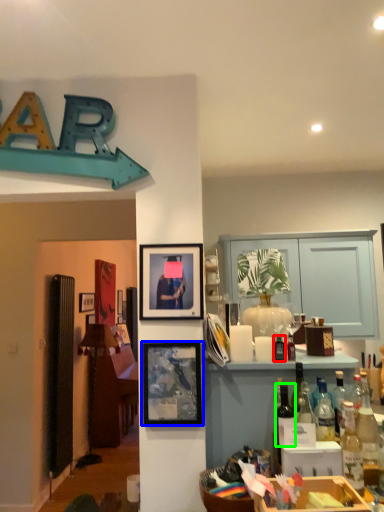
Question: Which object is positioned farthest from bottle (highlighted by a red box)? Select from picture frame (highlighted by a blue box) and bottle (highlighted by a green box).

Choices:
 (A) picture frame
 (B) bottle

Answer: (A)